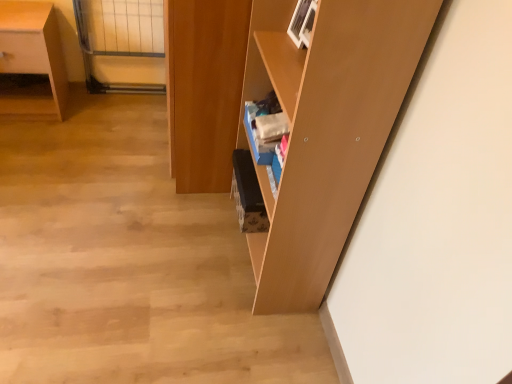
Measure the distance between matte wood desk at left and camera.

The distance of matte wood desk at left from camera is 1.83 meters.

Where is `matte wood desk at left`? The width and height of the screenshot is (512, 384). matte wood desk at left is located at coordinates (32, 54).

At what (x,y) coordinates should I click in order to perform the action: click on matte wood shelf at center. Please return your answer as a coordinate pair (x, y). Looking at the image, I should click on (326, 130).

Locate an element on the screen. The image size is (512, 384). matte wood desk at left is located at coordinates (32, 54).

From the image's perspective, is matte wood shelf at center on top of wooden cabinet at center?

Incorrect, from the image's perspective, matte wood shelf at center is lower than wooden cabinet at center.

Is point (284, 242) closer or farther from the camera than point (172, 107)?

Point (284, 242) is closer to the camera than point (172, 107).

Considering their positions, is matte wood shelf at center located in front of or behind wooden cabinet at center?

Clearly, matte wood shelf at center is in front of wooden cabinet at center.

Is matte wood shelf at center next to wooden cabinet at center?

matte wood shelf at center and wooden cabinet at center are clearly separated.

Do you think wooden cabinet at center is within matte wood desk at left, or outside of it?

The correct answer is: outside.

Considering the positions of point (172, 6) and point (54, 37), is point (172, 6) closer or farther from the camera than point (54, 37)?

Clearly, point (172, 6) is closer to the camera than point (54, 37).

From a real-world perspective, is wooden cabinet at center positioned under matte wood desk at left based on gravity?

Incorrect, from a real-world perspective, wooden cabinet at center is higher than matte wood desk at left.

Is wooden cabinet at center beside matte wood desk at left?

wooden cabinet at center and matte wood desk at left are clearly separated.

Is matte wood shelf at center in contact with clear glass door at upper left?

No, matte wood shelf at center is not next to clear glass door at upper left.

Considering the relative positions of matte wood shelf at center and clear glass door at upper left in the image provided, is matte wood shelf at center to the left or to the right of clear glass door at upper left?

matte wood shelf at center is to the right of clear glass door at upper left.

From the image's perspective, which object appears higher, clear glass door at upper left or matte wood shelf at center?

clear glass door at upper left appears higher in the image.

Between clear glass door at upper left and matte wood shelf at center, which one is positioned behind?

clear glass door at upper left.

Considering the sizes of objects clear glass door at upper left and matte wood shelf at center in the image provided, who is smaller, clear glass door at upper left or matte wood shelf at center?

clear glass door at upper left.

From a real-world perspective, which object rests below the other?

In real-world perspective, matte wood desk at left is lower.

From the image's perspective, is clear glass door at upper left above matte wood desk at left?

Yes, from the image's perspective, clear glass door at upper left is above matte wood desk at left.

Which object is closer to the camera, clear glass door at upper left or matte wood desk at left?

Positioned in front is matte wood desk at left.

Are matte wood desk at left and clear glass door at upper left far apart?

No, matte wood desk at left is not far from clear glass door at upper left.

From a real-world perspective, is matte wood desk at left positioned above or below clear glass door at upper left?

matte wood desk at left is situated lower than clear glass door at upper left in the real world.

Can you confirm if matte wood desk at left is shorter than clear glass door at upper left?

Correct, matte wood desk at left is not as tall as clear glass door at upper left.

You are a GUI agent. You are given a task and a screenshot of the screen. Output one action in this format:
    pyautogui.click(x=<x>, y=<y>)
    Task: Click on the shelf located below the wooden cabinet at center (from the image's perspective)
    
    Given the screenshot: What is the action you would take?
    pyautogui.click(x=326, y=130)

Considering the sizes of objects wooden cabinet at center and matte wood shelf at center in the image provided, who is shorter, wooden cabinet at center or matte wood shelf at center?

wooden cabinet at center is shorter.

How far apart are wooden cabinet at center and matte wood shelf at center?

A distance of 13.66 inches exists between wooden cabinet at center and matte wood shelf at center.

Consider the image. Which object is thinner, wooden cabinet at center or matte wood shelf at center?

matte wood shelf at center.

Find the location of `cabinetry below the matte wood shelf at center (from a real-world perspective)`. cabinetry below the matte wood shelf at center (from a real-world perspective) is located at coordinates (204, 89).

Identify the location of desk that is on the left side of wooden cabinet at center. (32, 54).

Considering their positions, is clear glass door at upper left positioned closer to wooden cabinet at center than matte wood shelf at center?

matte wood shelf at center is positioned closer to the anchor wooden cabinet at center.

From the image, which object appears to be nearer to matte wood shelf at center, wooden cabinet at center or clear glass door at upper left?

wooden cabinet at center is closer to matte wood shelf at center.

Based on their spatial positions, is matte wood shelf at center or matte wood desk at left further from wooden cabinet at center?

matte wood desk at left is positioned further to the anchor wooden cabinet at center.

Based on their spatial positions, is matte wood desk at left or matte wood shelf at center closer to wooden cabinet at center?

The object closer to wooden cabinet at center is matte wood shelf at center.

Based on their spatial positions, is wooden cabinet at center or matte wood desk at left further from clear glass door at upper left?

The object further to clear glass door at upper left is wooden cabinet at center.

Estimate the real-world distances between objects in this image. Which object is closer to matte wood desk at left, wooden cabinet at center or matte wood shelf at center?

wooden cabinet at center is positioned closer to the anchor matte wood desk at left.

Which object lies further to the anchor point clear glass door at upper left, matte wood shelf at center or matte wood desk at left?

matte wood shelf at center is positioned further to the anchor clear glass door at upper left.

Which object lies nearer to the anchor point matte wood shelf at center, wooden cabinet at center or matte wood desk at left?

wooden cabinet at center.

Identify the location of cabinetry between matte wood shelf at center and clear glass door at upper left from front to back. This screenshot has height=384, width=512. (204, 89).

This screenshot has width=512, height=384. I want to click on cabinetry located between matte wood desk at left and matte wood shelf at center in the left-right direction, so click(204, 89).

Identify the location of glass door situated between matte wood desk at left and wooden cabinet at center from left to right. This screenshot has height=384, width=512. (120, 27).

This screenshot has width=512, height=384. In order to click on glass door between matte wood desk at left and matte wood shelf at center from left to right in this screenshot , I will do `click(120, 27)`.